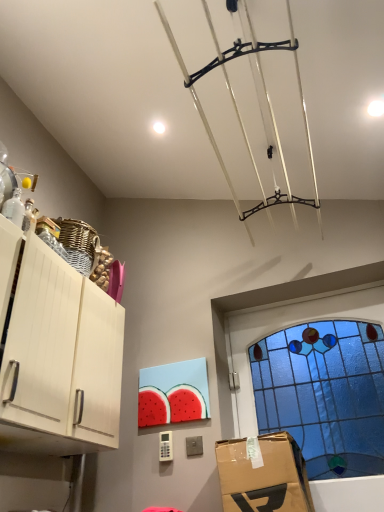
Question: Is white matte cabinet at left looking in the opposite direction of blue stained glass window at upper right?

Choices:
 (A) yes
 (B) no

Answer: (B)

Question: Is white matte cabinet at left completely or partially outside of blue stained glass window at upper right?

Choices:
 (A) no
 (B) yes

Answer: (B)

Question: Does white matte cabinet at left have a greater height compared to blue stained glass window at upper right?

Choices:
 (A) no
 (B) yes

Answer: (A)

Question: Can you confirm if white matte cabinet at left is smaller than blue stained glass window at upper right?

Choices:
 (A) no
 (B) yes

Answer: (A)

Question: Does white matte cabinet at left have a lesser width compared to blue stained glass window at upper right?

Choices:
 (A) yes
 (B) no

Answer: (B)

Question: Choose the correct answer: Is white matte cabinet at left inside blue stained glass window at upper right or outside it?

Choices:
 (A) outside
 (B) inside

Answer: (A)

Question: Visually, is white matte cabinet at left positioned to the left or to the right of blue stained glass window at upper right?

Choices:
 (A) right
 (B) left

Answer: (B)

Question: In terms of width, does white matte cabinet at left look wider or thinner when compared to blue stained glass window at upper right?

Choices:
 (A) wide
 (B) thin

Answer: (A)

Question: Is white matte cabinet at left taller or shorter than blue stained glass window at upper right?

Choices:
 (A) short
 (B) tall

Answer: (A)

Question: Based on their sizes in the image, would you say blue stained glass window at upper right is bigger or smaller than white matte cabinet at left?

Choices:
 (A) small
 (B) big

Answer: (A)

Question: Considering the positions of point (253, 315) and point (21, 312), is point (253, 315) closer or farther from the camera than point (21, 312)?

Choices:
 (A) closer
 (B) farther

Answer: (B)

Question: Considering the relative positions of blue stained glass window at upper right and white matte cabinet at left in the image provided, is blue stained glass window at upper right to the left or to the right of white matte cabinet at left?

Choices:
 (A) right
 (B) left

Answer: (A)

Question: Do you think blue stained glass window at upper right is within white matte cabinet at left, or outside of it?

Choices:
 (A) inside
 (B) outside

Answer: (B)

Question: From the image's perspective, is transparent glass bottles at left positioned above or below white matte cabinet at left?

Choices:
 (A) below
 (B) above

Answer: (B)

Question: Is transparent glass bottles at left wider or thinner than white matte cabinet at left?

Choices:
 (A) wide
 (B) thin

Answer: (B)